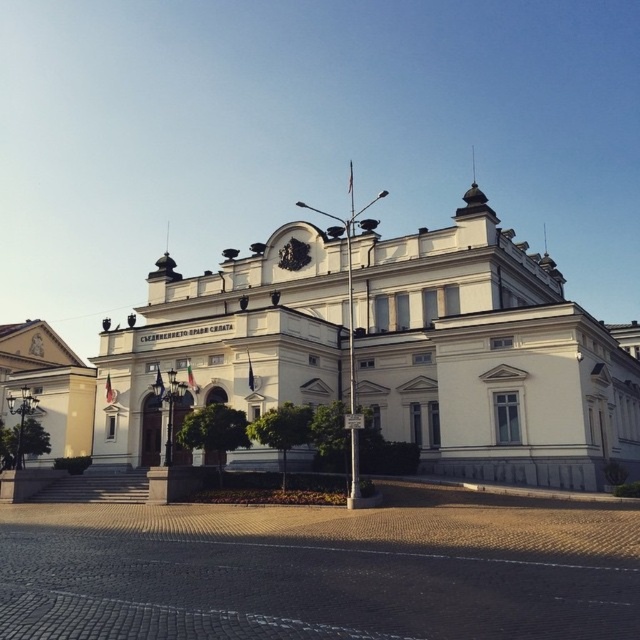
From the picture: Does white stone building at center appear over white stone building at lower left?

Yes, white stone building at center is above white stone building at lower left.

Does point (237, 458) come closer to viewer compared to point (84, 376)?

That is True.

Who is more forward, (497, 256) or (84, 426)?

Point (497, 256) is more forward.

The image size is (640, 640). I want to click on white stone building at center, so click(x=388, y=349).